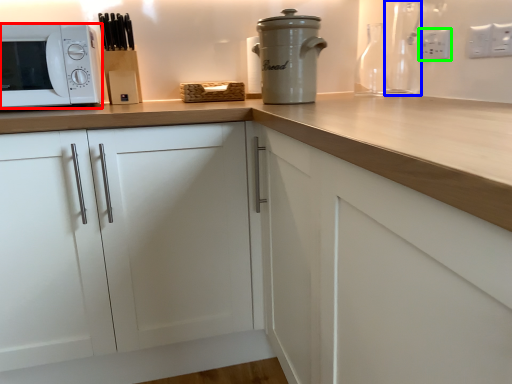
Question: Estimate the real-world distances between objects in this image. Which object is farther from microwave oven (highlighted by a red box), bottle (highlighted by a blue box) or electric outlet (highlighted by a green box)?

Choices:
 (A) bottle
 (B) electric outlet

Answer: (B)